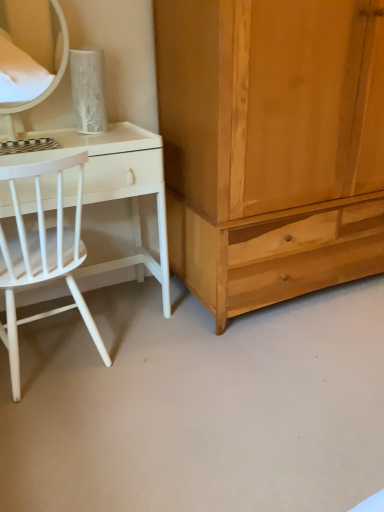
Question: Considering the relative positions of white glossy desk at left and light brown wood cabinet at right in the image provided, is white glossy desk at left to the right of light brown wood cabinet at right from the viewer's perspective?

Choices:
 (A) no
 (B) yes

Answer: (A)

Question: Is white glossy desk at left positioned behind light brown wood cabinet at right?

Choices:
 (A) yes
 (B) no

Answer: (A)

Question: Could light brown wood cabinet at right be considered to be inside white glossy desk at left?

Choices:
 (A) yes
 (B) no

Answer: (B)

Question: From a real-world perspective, is white glossy desk at left positioned under light brown wood cabinet at right based on gravity?

Choices:
 (A) yes
 (B) no

Answer: (A)

Question: From a real-world perspective, is white glossy desk at left over light brown wood cabinet at right?

Choices:
 (A) yes
 (B) no

Answer: (B)

Question: From the image's perspective, is white matte wood chair at left above or below white glossy desk at left?

Choices:
 (A) below
 (B) above

Answer: (A)

Question: Considering the positions of white matte wood chair at left and white glossy desk at left in the image, is white matte wood chair at left wider or thinner than white glossy desk at left?

Choices:
 (A) thin
 (B) wide

Answer: (B)

Question: Is white matte wood chair at left taller or shorter than white glossy desk at left?

Choices:
 (A) tall
 (B) short

Answer: (A)

Question: Visually, is white matte wood chair at left positioned to the left or to the right of white glossy desk at left?

Choices:
 (A) right
 (B) left

Answer: (B)

Question: In the image, is matte white mirror at upper left positioned in front of or behind white glossy desk at left?

Choices:
 (A) behind
 (B) front

Answer: (A)

Question: From the image's perspective, relative to white glossy desk at left, is matte white mirror at upper left above or below?

Choices:
 (A) above
 (B) below

Answer: (A)

Question: In terms of width, does matte white mirror at upper left look wider or thinner when compared to white glossy desk at left?

Choices:
 (A) thin
 (B) wide

Answer: (A)

Question: Would you say matte white mirror at upper left is to the left or to the right of white glossy desk at left in the picture?

Choices:
 (A) right
 (B) left

Answer: (B)

Question: From a real-world perspective, is light brown wood cabinet at right above or below white matte wood chair at left?

Choices:
 (A) above
 (B) below

Answer: (A)

Question: In the image, is light brown wood cabinet at right on the left side or the right side of white matte wood chair at left?

Choices:
 (A) right
 (B) left

Answer: (A)